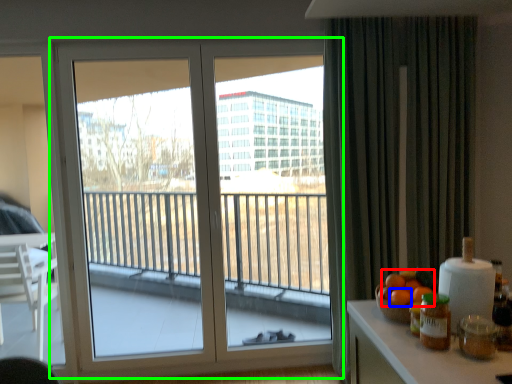
Question: Estimate the real-world distances between objects in this image. Which object is closer to orange (highlighted by a red box), orange (highlighted by a blue box) or window (highlighted by a green box)?

Choices:
 (A) orange
 (B) window

Answer: (A)